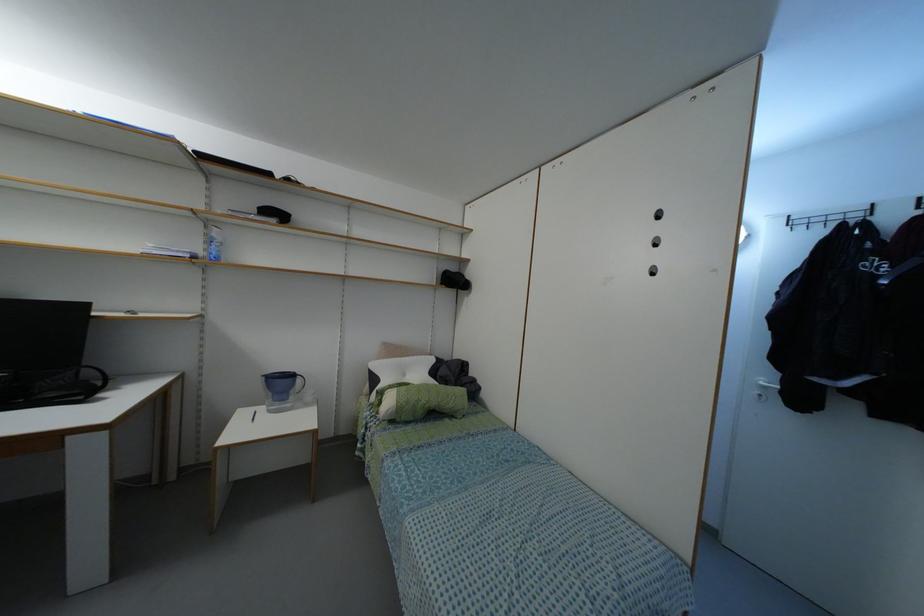
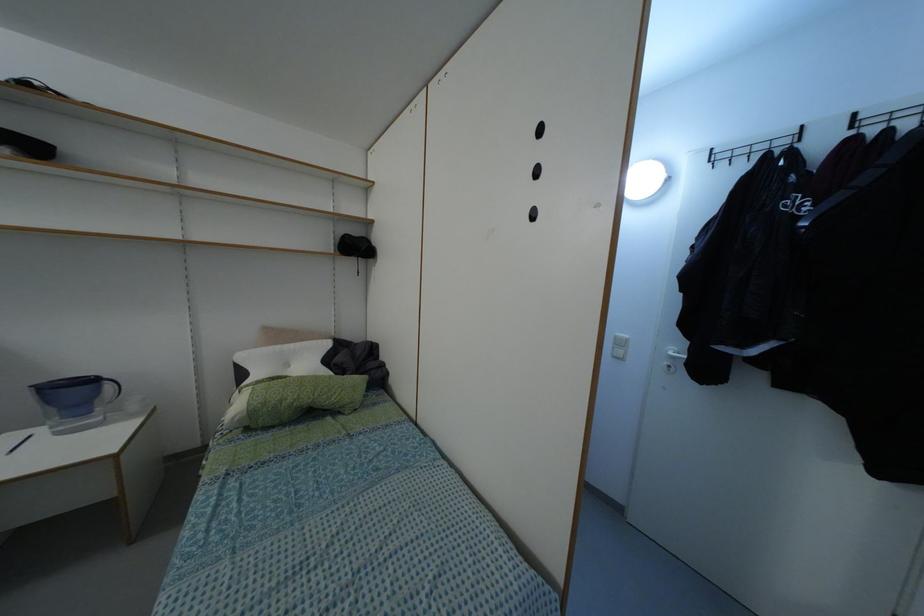
Which direction would the cameraman need to move to produce the second image?

The cameraman moved toward right, forward.